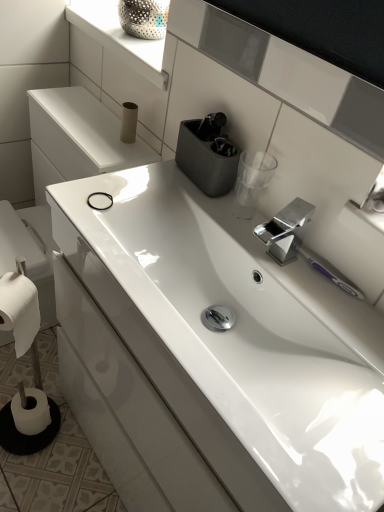
Where is `vacant area that is situated to the right of polished metallic tap at center`? This screenshot has height=512, width=384. vacant area that is situated to the right of polished metallic tap at center is located at coordinates (328, 295).